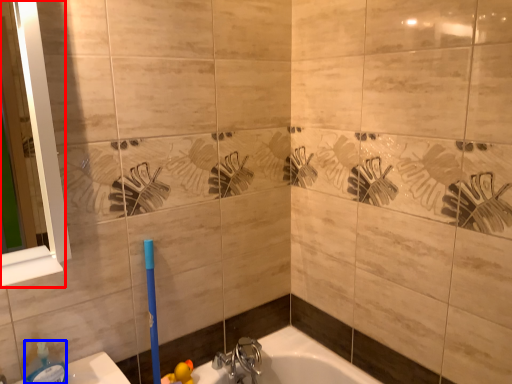
Question: Which of the following is the farthest to the observer, mirror (highlighted by a red box) or soap dispenser (highlighted by a blue box)?

Choices:
 (A) mirror
 (B) soap dispenser

Answer: (B)